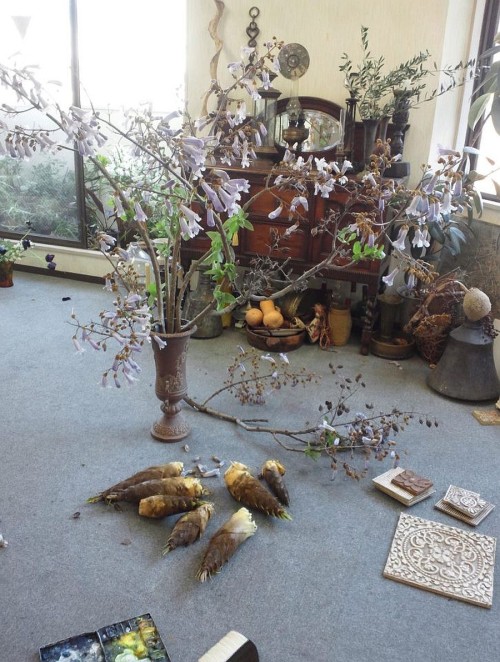
Where is `ivory colored designed tile`? This screenshot has height=662, width=500. ivory colored designed tile is located at coordinates (446, 571).